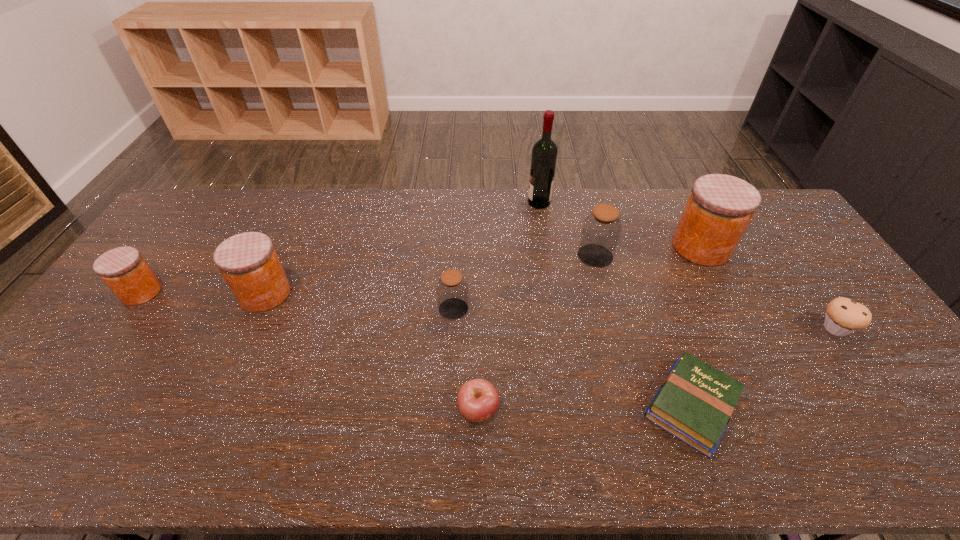
The image size is (960, 540). Find the location of `free space located 0.270m on the left of the second smallest orange jar`. free space located 0.270m on the left of the second smallest orange jar is located at coordinates (149, 294).

You are a GUI agent. You are given a task and a screenshot of the screen. Output one action in this format:
    pyautogui.click(x=<x>, y=<y>)
    Task: Click on the vacant position located on the right of the bigger brown jar
    The height and width of the screenshot is (540, 960).
    Given the screenshot: What is the action you would take?
    pyautogui.click(x=662, y=255)

In order to click on vacant area situated on the back of the smallest orange jar in this screenshot , I will do `click(190, 225)`.

Identify the location of vacant space located on the left of the smaller brown jar. The image size is (960, 540). (397, 309).

Identify the location of free space located on the back of the rightmost object. The height and width of the screenshot is (540, 960). (806, 286).

This screenshot has height=540, width=960. In order to click on free region located 0.050m on the side of the apple with the unique marking in this screenshot , I will do `click(478, 453)`.

Find the location of `free space located on the right of the shortest object`. free space located on the right of the shortest object is located at coordinates (855, 406).

You are a GUI agent. You are given a task and a screenshot of the screen. Output one action in this format:
    pyautogui.click(x=<x>, y=<y>)
    Task: Click on the alcohol that is at the far edge
    The width and height of the screenshot is (960, 540).
    Given the screenshot: What is the action you would take?
    pyautogui.click(x=544, y=153)

Identify the location of jar that is at the far edge. (720, 207).

Locate an element on the screen. The image size is (960, 540). apple positioned at the near edge is located at coordinates (478, 400).